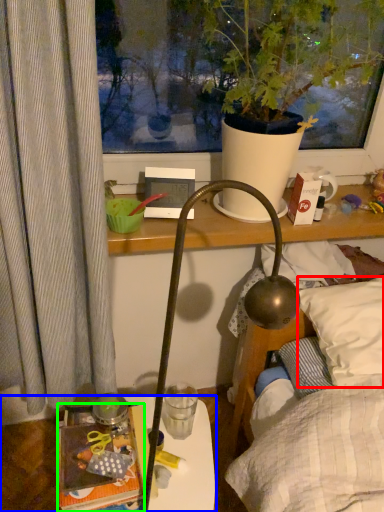
Question: Which object is positioned closest to pillow (highlighted by a red box)? Select from table (highlighted by a blue box) and book (highlighted by a green box).

Choices:
 (A) table
 (B) book

Answer: (B)